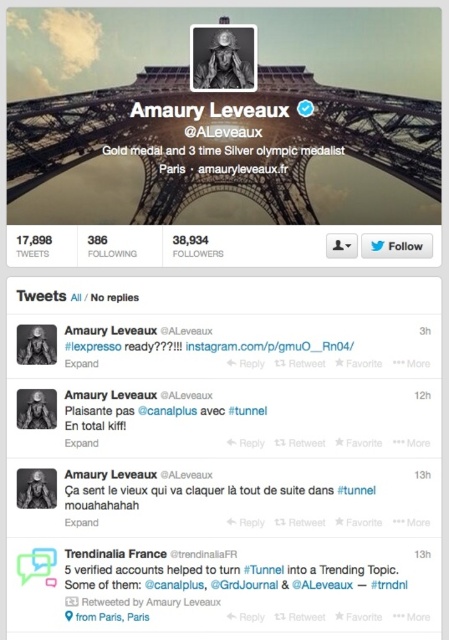
From the picture: Is metallic structure at upper center bigger than black matte portrait at upper center?

Yes.

In the scene shown: Measure the distance between metallic structure at upper center and black matte portrait at upper center.

17.46 meters

Who is more distant from viewer, [89,141] or [193,35]?

Point [193,35]

At what (x,y) coordinates should I click in order to perform the action: click on metallic structure at upper center. Please return your answer as a coordinate pair (x, y). Looking at the image, I should click on (224, 140).